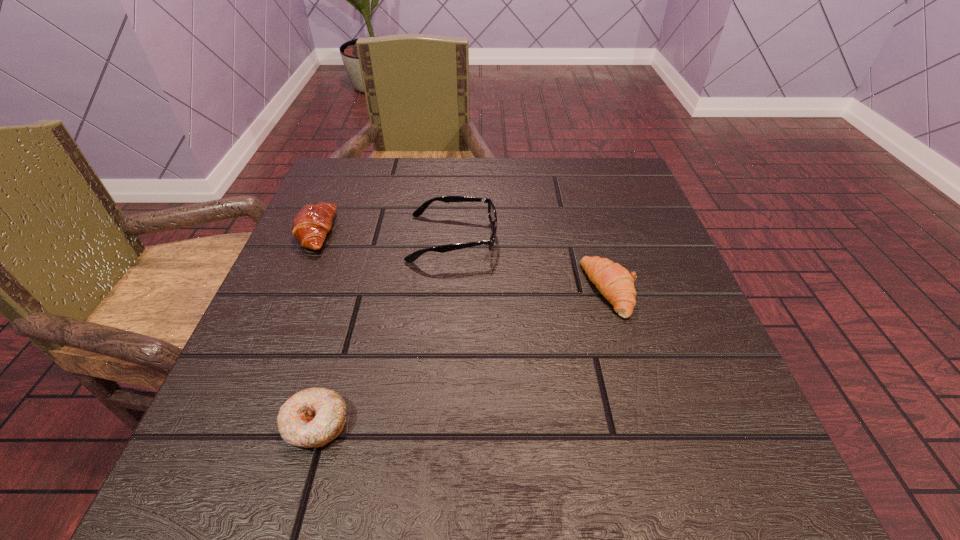
Locate an element on the screen. Image resolution: width=960 pixels, height=540 pixels. free location that satisfies the following two spatial constraints: 1. on the front side of the doughnut; 2. on the right side of the leftmost object is located at coordinates (232, 424).